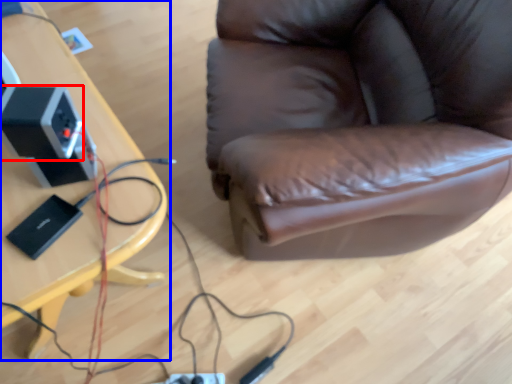
Question: Which point is closer to the camera, speaker (highlighted by a red box) or table (highlighted by a blue box)?

Choices:
 (A) speaker
 (B) table

Answer: (B)